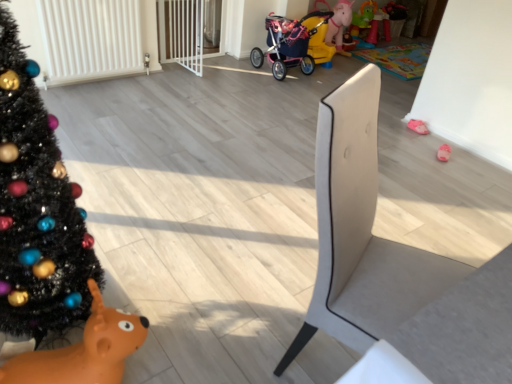
Question: Is suede-like beige chair at center-right thinner than pink fabric baby carriage at center?

Choices:
 (A) yes
 (B) no

Answer: (A)

Question: Is suede-like beige chair at center-right smaller than pink fabric baby carriage at center?

Choices:
 (A) yes
 (B) no

Answer: (B)

Question: Are suede-like beige chair at center-right and pink fabric baby carriage at center beside each other?

Choices:
 (A) yes
 (B) no

Answer: (B)

Question: From a real-world perspective, is suede-like beige chair at center-right under pink fabric baby carriage at center?

Choices:
 (A) yes
 (B) no

Answer: (B)

Question: Is suede-like beige chair at center-right aimed at pink fabric baby carriage at center?

Choices:
 (A) no
 (B) yes

Answer: (A)

Question: Is suede-like beige chair at center-right positioned beyond the bounds of pink fabric baby carriage at center?

Choices:
 (A) no
 (B) yes

Answer: (B)

Question: Is suede-like beige chair at center-right surrounding pink fabric slipper at lower right, which is counted as the second toy, starting from the front?

Choices:
 (A) yes
 (B) no

Answer: (B)

Question: From a real-world perspective, is suede-like beige chair at center-right positioned over pink fabric slipper at lower right, the 1th toy positioned from the right, based on gravity?

Choices:
 (A) no
 (B) yes

Answer: (B)

Question: From the image's perspective, does suede-like beige chair at center-right appear higher than pink fabric slipper at lower right, which is counted as the second toy, starting from the front?

Choices:
 (A) yes
 (B) no

Answer: (B)

Question: Is suede-like beige chair at center-right looking in the opposite direction of pink fabric slipper at lower right, acting as the 1th toy starting from the top?

Choices:
 (A) no
 (B) yes

Answer: (A)

Question: Is suede-like beige chair at center-right taller than pink fabric slipper at lower right, acting as the 1th toy starting from the top?

Choices:
 (A) no
 (B) yes

Answer: (B)

Question: From a real-world perspective, is suede-like beige chair at center-right under pink fabric slipper at lower right, the 1th toy positioned from the right?

Choices:
 (A) yes
 (B) no

Answer: (B)

Question: Is the surface of pink fabric slipper at lower right, marked as the 2th toy in a left-to-right arrangement, in direct contact with pink fabric baby carriage at center?

Choices:
 (A) yes
 (B) no

Answer: (B)